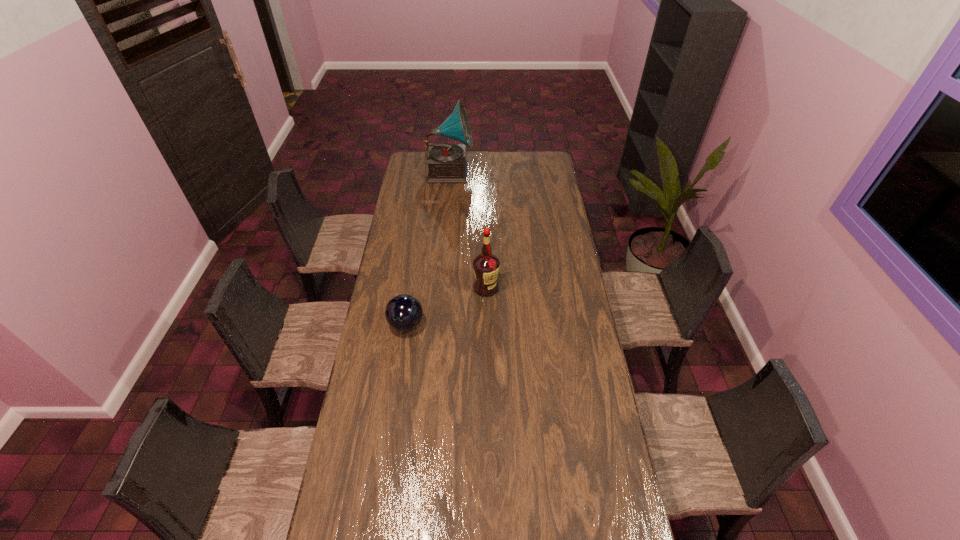
Where is `the tallest object`? The width and height of the screenshot is (960, 540). the tallest object is located at coordinates (446, 162).

At what (x,y) coordinates should I click in order to perform the action: click on record player. Please return your answer as a coordinate pair (x, y). Image resolution: width=960 pixels, height=540 pixels. Looking at the image, I should click on (446, 162).

Identify the location of the second farthest object. (486, 266).

At what (x,y) coordinates should I click in order to perform the action: click on alcohol. Please return your answer as a coordinate pair (x, y). Looking at the image, I should click on (x=486, y=266).

In order to click on bowling ball in this screenshot , I will do `click(404, 312)`.

I want to click on the nearest object, so click(404, 312).

In order to click on vacant space located on the horn of the farthest object in this screenshot , I will do `click(488, 171)`.

Find the location of a particular element. The height and width of the screenshot is (540, 960). vacant space located 0.340m on the label of the second shortest object is located at coordinates (487, 362).

This screenshot has width=960, height=540. Identify the location of vacant position located 0.090m on the side of the shortest object with the finger holes. (401, 358).

The width and height of the screenshot is (960, 540). What are the coordinates of `object located at the far edge` in the screenshot? It's located at (446, 162).